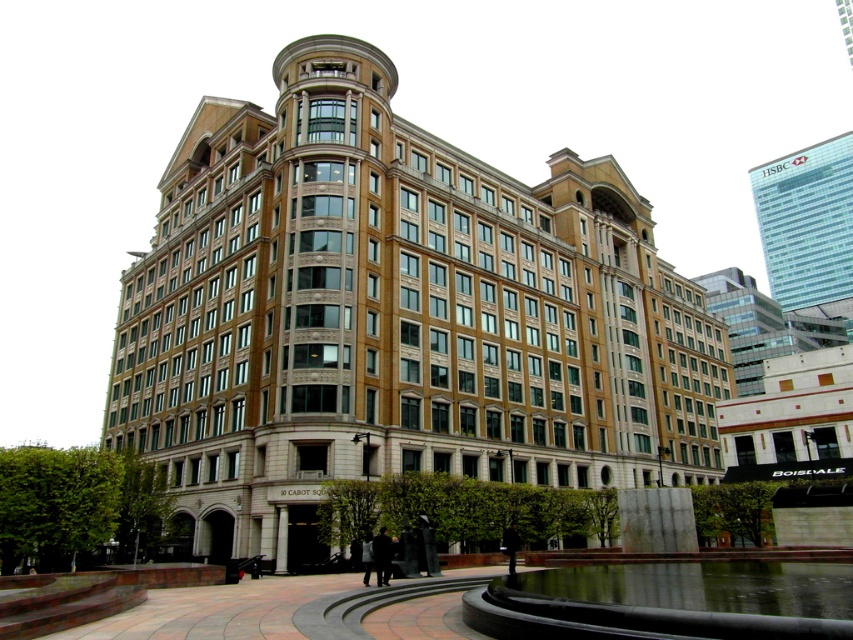
Question: Is brown stone building at center to the left of glassy reflective skyscraper at upper right from the viewer's perspective?

Choices:
 (A) no
 (B) yes

Answer: (B)

Question: Can you confirm if brown stone building at center is positioned above glassy reflective skyscraper at upper right?

Choices:
 (A) no
 (B) yes

Answer: (A)

Question: Does brown stone building at center appear over glassy reflective skyscraper at upper right?

Choices:
 (A) no
 (B) yes

Answer: (A)

Question: Which of the following is the closest to the observer?

Choices:
 (A) brown stone building at center
 (B) glassy reflective skyscraper at upper right

Answer: (A)

Question: Which point is closer to the camera?

Choices:
 (A) (473, 342)
 (B) (834, 189)

Answer: (A)